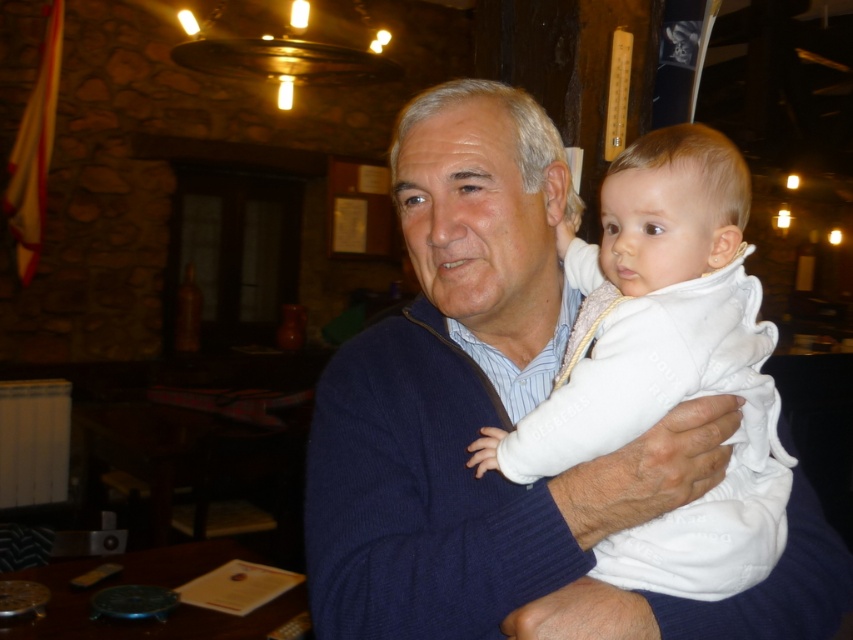
Does white soft baby at center lie behind white soft fabric at center?

That is True.

Describe the element at coordinates (665, 364) in the screenshot. I see `white soft baby at center` at that location.

This screenshot has height=640, width=853. I want to click on white soft baby at center, so click(x=665, y=364).